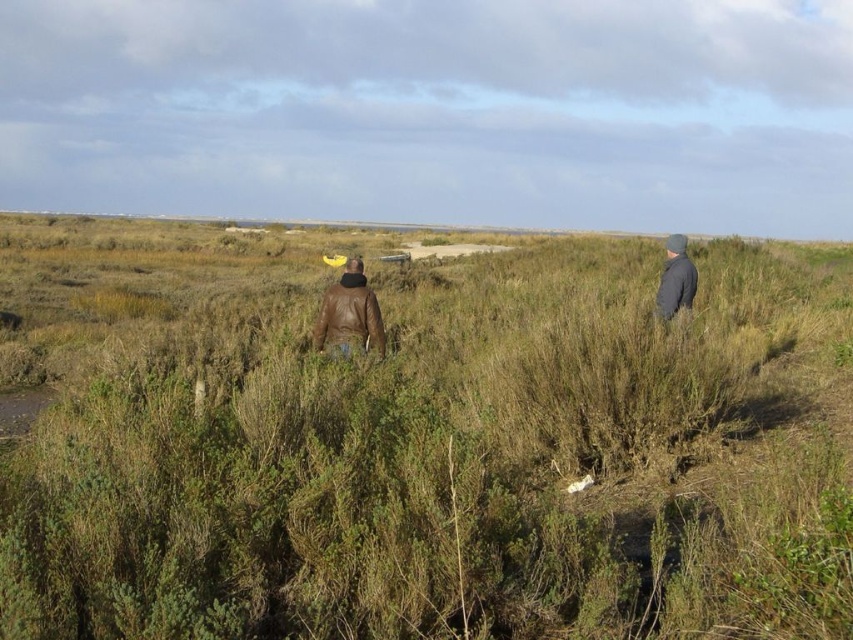
Is green grassy at center above gray woolen hat at right?

Correct, green grassy at center is located above gray woolen hat at right.

Can you confirm if green grassy at center is wider than gray woolen hat at right?

Yes, green grassy at center is wider than gray woolen hat at right.

Where is `green grassy at center`? This screenshot has width=853, height=640. green grassy at center is located at coordinates (422, 442).

Does green grassy at center have a lesser height compared to brown leather jacket at center?

No, green grassy at center is not shorter than brown leather jacket at center.

Is green grassy at center in front of brown leather jacket at center?

Yes, it is in front of brown leather jacket at center.

Is point (698, 620) in front of point (352, 323)?

Yes, point (698, 620) is in front of point (352, 323).

Where is `green grassy at center`? Image resolution: width=853 pixels, height=640 pixels. green grassy at center is located at coordinates (422, 442).

Is brown leather jacket at center in front of gray woolen hat at right?

Yes.

Who is shorter, brown leather jacket at center or gray woolen hat at right?

gray woolen hat at right

Describe the element at coordinates (349, 314) in the screenshot. This screenshot has height=640, width=853. I see `brown leather jacket at center` at that location.

Locate an element on the screen. This screenshot has height=640, width=853. brown leather jacket at center is located at coordinates (349, 314).